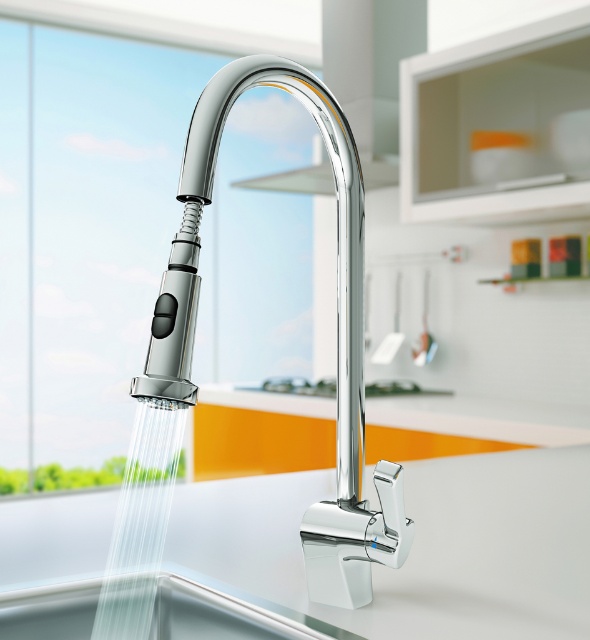
Does chrome/polished metal sink at center appear on the right side of chrome/metallic faucet at center?

Indeed, chrome/polished metal sink at center is positioned on the right side of chrome/metallic faucet at center.

Who is shorter, chrome/polished metal sink at center or chrome/metallic faucet at center?

chrome/polished metal sink at center

Does point (472, 568) come behind point (309, 76)?

Yes, it is.

Where is `chrome/polished metal sink at center`? The image size is (590, 640). chrome/polished metal sink at center is located at coordinates (417, 545).

Who is more distant from viewer, (337, 244) or (129, 529)?

The point (129, 529) is more distant.

Who is taller, chrome/metallic faucet at center or clear liquid water at lower left?

chrome/metallic faucet at center

Is point (345, 499) more distant than point (169, 468)?

That is False.

I want to click on chrome/metallic faucet at center, so click(337, 333).

Is chrome/polished metal sink at center thinner than clear liquid water at lower left?

No.

Who is positioned more to the left, chrome/polished metal sink at center or clear liquid water at lower left?

Positioned to the left is clear liquid water at lower left.

Describe the element at coordinates (417, 545) in the screenshot. I see `chrome/polished metal sink at center` at that location.

Where is `chrome/polished metal sink at center`? The width and height of the screenshot is (590, 640). chrome/polished metal sink at center is located at coordinates (417, 545).